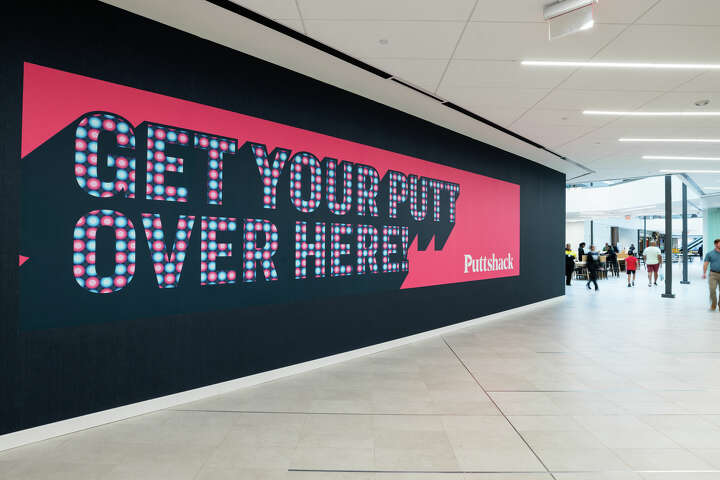
Identify the location of light. The image size is (720, 480). (574, 64).